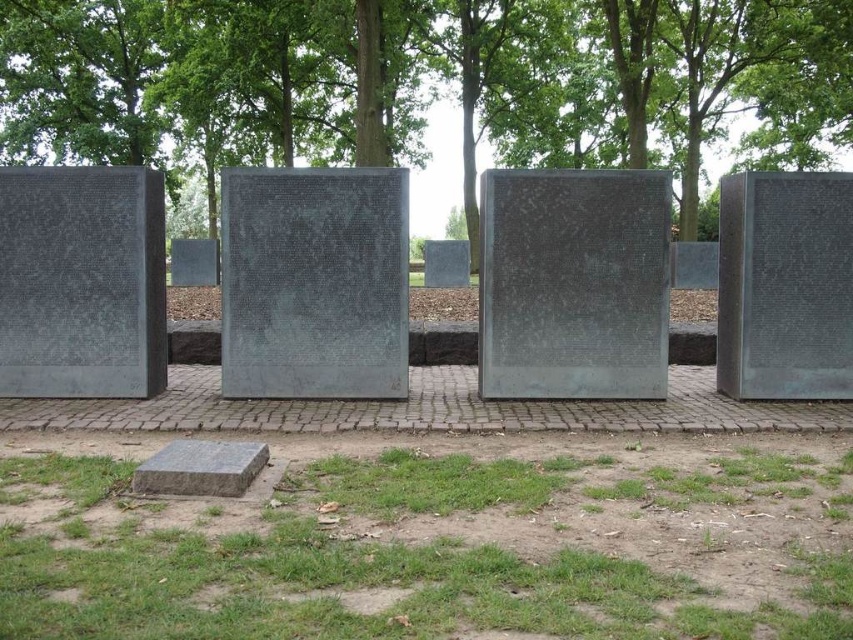
Question: Does brushed metal plaque at left have a lesser width compared to polished bronze plaque at center?

Choices:
 (A) no
 (B) yes

Answer: (A)

Question: Among these objects, which one is farthest from the camera?

Choices:
 (A) polished gray stone plaque at center
 (B) brushed metal plaque at left

Answer: (A)

Question: Does green leafy tree at upper center appear on the left side of polished gray stone plaque at center?

Choices:
 (A) yes
 (B) no

Answer: (A)

Question: Which of the following is the closest to the observer?

Choices:
 (A) polished gray stone plaque at center
 (B) brushed metal plaque at center

Answer: (B)

Question: Is green grass at lower center thinner than polished gray stone plaque at center?

Choices:
 (A) yes
 (B) no

Answer: (B)

Question: Which of the following is the closest to the observer?

Choices:
 (A) brushed metal plaque at center
 (B) brushed metal plaque at left

Answer: (A)